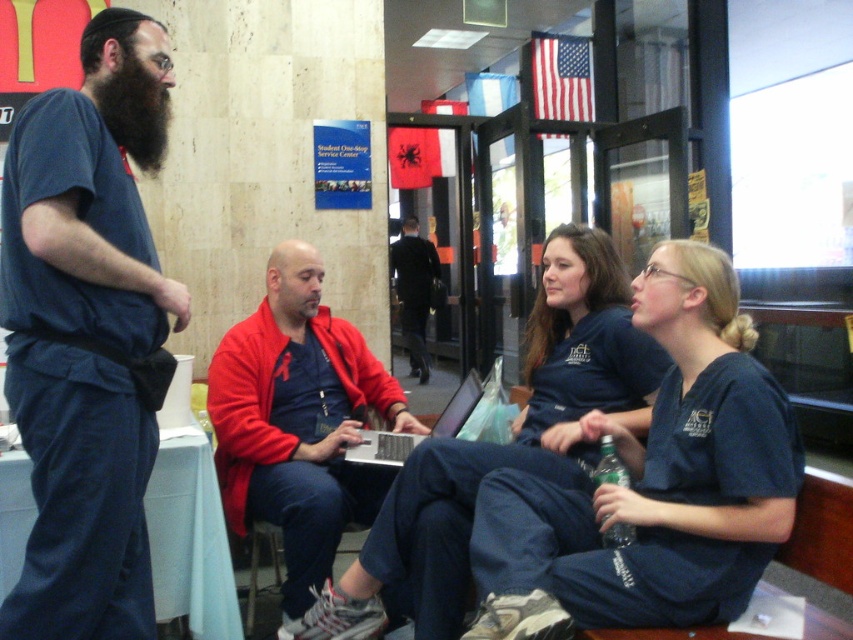
You are standing at the entrance of the lobby and need to locate the blue scrubs at center. According to the coordinates provided, where exactly would you find them?

The blue scrubs at center are located at coordinates point (654, 483).

You are standing in the lobby and need to find the blue denim pants at center. According to the scene description, where would you look to find them?

The blue denim pants at center are located at the 2D coordinates point (88, 332) in the scene.